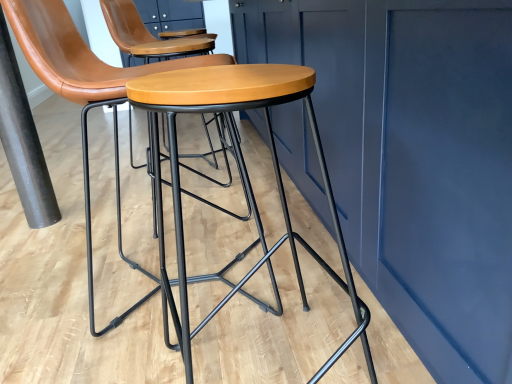
In order to face matte black stool at center, should I rotate leftwards or rightwards?

Rotate your view left by about 12.545°.

What do you see at coordinates (241, 179) in the screenshot?
I see `wooden/matte stool at center` at bounding box center [241, 179].

You are a GUI agent. You are given a task and a screenshot of the screen. Output one action in this format:
    pyautogui.click(x=<x>, y=<y>)
    Task: Click on the wooden/matte stool at center
    The height and width of the screenshot is (384, 512).
    Given the screenshot: What is the action you would take?
    pyautogui.click(x=241, y=179)

Identify the location of matte black stool at center. (79, 83).

From the picture: Based on their sizes in the image, would you say matte black stool at center is bigger or smaller than black matte pole at left?

matte black stool at center is bigger than black matte pole at left.

From the image's perspective, is matte black stool at center above or below black matte pole at left?

From the image's perspective, matte black stool at center appears below black matte pole at left.

Could black matte pole at left be considered to be inside matte black stool at center?

No, matte black stool at center does not contain black matte pole at left.

In the scene shown: Considering the positions of objects matte black stool at center and black matte pole at left in the image provided, who is more to the left, matte black stool at center or black matte pole at left?

Positioned to the left is black matte pole at left.

Is matte black stool at center oriented away from wooden/matte stool at center?

No, matte black stool at center's orientation is not away from wooden/matte stool at center.

Is matte black stool at center positioned beyond the bounds of wooden/matte stool at center?

matte black stool at center is positioned outside wooden/matte stool at center.

Based on the photo, from a real-world perspective, is matte black stool at center below wooden/matte stool at center?

Actually, matte black stool at center is physically above wooden/matte stool at center in the real world.

Identify the location of stool below the matte black stool at center (from the image's perspective). Image resolution: width=512 pixels, height=384 pixels. (241, 179).

Is wooden/matte stool at center positioned beyond the bounds of matte black stool at center?

Yes.

Considering the points (156, 97) and (78, 39), which point is behind, point (156, 97) or point (78, 39)?

The point (78, 39) is behind.

Where is `stool located in front of the matte black stool at center`? stool located in front of the matte black stool at center is located at coordinates (241, 179).

From the image's perspective, which one is positioned higher, wooden/matte stool at center or matte black stool at center?

matte black stool at center.

Is black matte pole at left facing away from matte black stool at center?

No, matte black stool at center is not at the back of black matte pole at left.

Looking at their sizes, would you say black matte pole at left is wider or thinner than matte black stool at center?

In the image, black matte pole at left appears to be more narrow than matte black stool at center.

From the image's perspective, is black matte pole at left above or below matte black stool at center?

black matte pole at left is above matte black stool at center.

Based on the photo, which is closer, (20,135) or (88,68)?

Point (88,68)

From a real-world perspective, which is physically above, wooden/matte stool at center or black matte pole at left?

black matte pole at left is physically above.

From the image's perspective, which is above, wooden/matte stool at center or black matte pole at left?

black matte pole at left appears higher in the image.

Which is more distant, (x=208, y=78) or (x=27, y=123)?

Point (x=27, y=123)

Can you confirm if wooden/matte stool at center is shorter than black matte pole at left?

Indeed, wooden/matte stool at center has a lesser height compared to black matte pole at left.

Between point (6, 74) and point (179, 238), which one is positioned in front?

The point (179, 238) is in front.

Is black matte pole at left directly adjacent to wooden/matte stool at center?

black matte pole at left is not next to wooden/matte stool at center, and they're not touching.

From a real-world perspective, who is located higher, black matte pole at left or wooden/matte stool at center?

black matte pole at left is physically above.

At what (x,y) coordinates should I click in order to perform the action: click on chair on the right of the black matte pole at left. Please return your answer as a coordinate pair (x, y). Looking at the image, I should click on (79, 83).

Locate an element on the screen. This screenshot has width=512, height=384. stool in front of the matte black stool at center is located at coordinates (241, 179).

Which object lies further to the anchor point black matte pole at left, wooden/matte stool at center or matte black stool at center?

wooden/matte stool at center is positioned further to the anchor black matte pole at left.

When comparing their distances from black matte pole at left, does matte black stool at center or wooden/matte stool at center seem closer?

Based on the image, matte black stool at center appears to be nearer to black matte pole at left.

When comparing their distances from matte black stool at center, does wooden/matte stool at center or black matte pole at left seem closer?

Based on the image, wooden/matte stool at center appears to be nearer to matte black stool at center.

From the image, which object appears to be nearer to matte black stool at center, black matte pole at left or wooden/matte stool at center?

wooden/matte stool at center is closer to matte black stool at center.

Looking at the image, which one is located further to wooden/matte stool at center, matte black stool at center or black matte pole at left?

Based on the image, black matte pole at left appears to be further to wooden/matte stool at center.

Based on their spatial positions, is black matte pole at left or matte black stool at center further from wooden/matte stool at center?

black matte pole at left is further to wooden/matte stool at center.

I want to click on chair between wooden/matte stool at center and black matte pole at left from front to back, so click(79, 83).